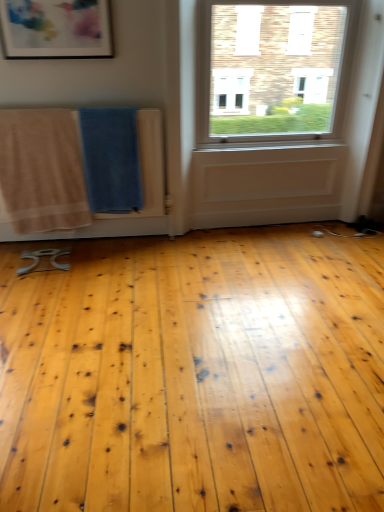
Question: From the image's perspective, is beige cotton towel at left, which is the 1th beach towel in left-to-right order, located beneath matte plastic picture frame at upper left?

Choices:
 (A) no
 (B) yes

Answer: (B)

Question: Is the depth of beige cotton towel at left, which is the 2th beach towel in right-to-left order, less than that of matte plastic picture frame at upper left?

Choices:
 (A) no
 (B) yes

Answer: (A)

Question: Is the surface of beige cotton towel at left, which is the 2th beach towel in right-to-left order, in direct contact with matte plastic picture frame at upper left?

Choices:
 (A) yes
 (B) no

Answer: (B)

Question: Can you confirm if beige cotton towel at left, which is the 1th beach towel in left-to-right order, is positioned to the left of matte plastic picture frame at upper left?

Choices:
 (A) no
 (B) yes

Answer: (B)

Question: Are beige cotton towel at left, which is the 2th beach towel in right-to-left order, and matte plastic picture frame at upper left far apart?

Choices:
 (A) no
 (B) yes

Answer: (A)

Question: Is point (29, 0) closer or farther from the camera than point (100, 194)?

Choices:
 (A) closer
 (B) farther

Answer: (A)

Question: Is matte plastic picture frame at upper left to the left or to the right of blue textured towel at center, positioned as the first beach towel in right-to-left order, in the image?

Choices:
 (A) right
 (B) left

Answer: (B)

Question: From their relative heights in the image, would you say matte plastic picture frame at upper left is taller or shorter than blue textured towel at center, positioned as the first beach towel in right-to-left order?

Choices:
 (A) tall
 (B) short

Answer: (B)

Question: Is matte plastic picture frame at upper left wider or thinner than blue textured towel at center, the 2th beach towel when ordered from left to right?

Choices:
 (A) thin
 (B) wide

Answer: (A)

Question: Would you say blue textured towel at center, positioned as the first beach towel in right-to-left order, is to the left or to the right of beige cotton towel at left, which is the 1th beach towel in left-to-right order, in the picture?

Choices:
 (A) right
 (B) left

Answer: (A)

Question: In terms of height, does blue textured towel at center, positioned as the first beach towel in right-to-left order, look taller or shorter compared to beige cotton towel at left, which is the 1th beach towel in left-to-right order?

Choices:
 (A) short
 (B) tall

Answer: (A)

Question: In terms of size, does blue textured towel at center, positioned as the first beach towel in right-to-left order, appear bigger or smaller than beige cotton towel at left, which is the 1th beach towel in left-to-right order?

Choices:
 (A) big
 (B) small

Answer: (B)

Question: From the image's perspective, is blue textured towel at center, positioned as the first beach towel in right-to-left order, positioned above or below beige cotton towel at left, which is the 1th beach towel in left-to-right order?

Choices:
 (A) below
 (B) above

Answer: (B)

Question: From a real-world perspective, relative to beige cotton towel at left, which is the 1th beach towel in left-to-right order, is matte plastic picture frame at upper left vertically above or below?

Choices:
 (A) above
 (B) below

Answer: (A)

Question: Is point (52, 45) positioned closer to the camera than point (59, 117)?

Choices:
 (A) farther
 (B) closer

Answer: (B)